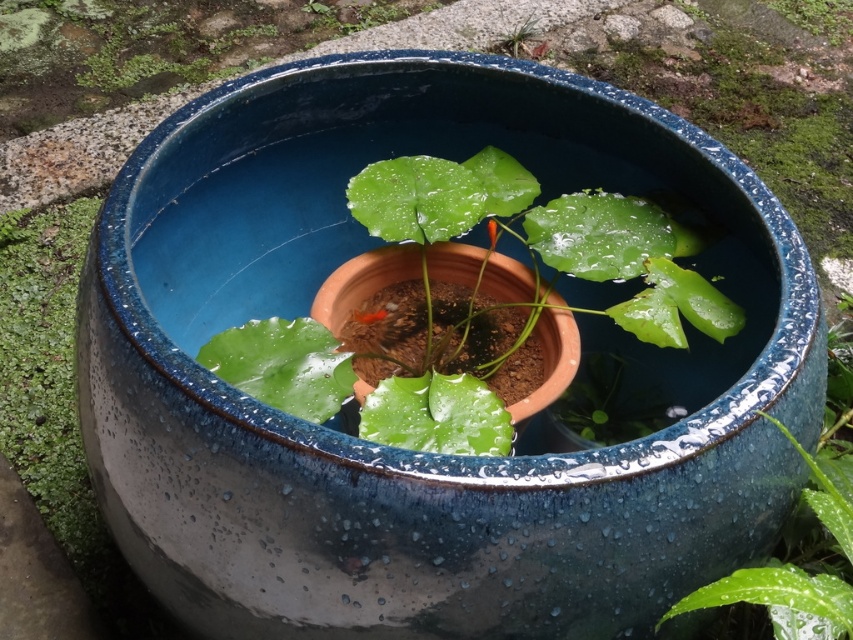
You are designing a garden layout and need to know which of the two green elements, the green moss at left or the green glossy leaf at upper center, takes up more space. Based on the scene, which one is bigger?

The green moss at left is larger in size than the green glossy leaf at upper center, so the green moss at left takes up more space.

In the scene shown: You are designing a small garden and want to place a decorative pond. The pond has two plants, the green glossy leaves at center and the green moss at left. Which plant has a larger width?

The green glossy leaves at center might be wider than green moss at left, so the green glossy leaves at center has a larger width.